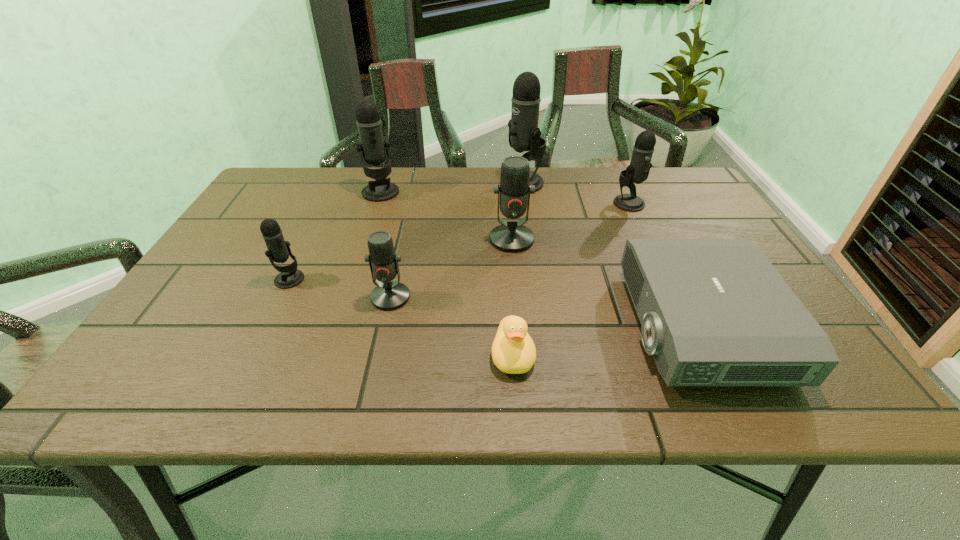
The image size is (960, 540). I want to click on the tallest object, so click(524, 135).

The image size is (960, 540). What are the coordinates of `the third black microphone from left to right` in the screenshot? It's located at tap(524, 135).

Where is `the third smallest black microphone`? The image size is (960, 540). the third smallest black microphone is located at coordinates (373, 146).

Locate an element on the screen. The image size is (960, 540). the fifth microphone from right to left is located at coordinates (373, 146).

What are the coordinates of `the bigger red microphone` in the screenshot? It's located at (513, 237).

Find the location of a particular element. The image size is (960, 540). the right red microphone is located at coordinates (513, 237).

You are a GUI agent. You are given a task and a screenshot of the screen. Output one action in this format:
    pyautogui.click(x=<x>, y=<y>)
    Task: Click on the rightmost microphone
    
    Given the screenshot: What is the action you would take?
    pyautogui.click(x=638, y=170)

Locate an element on the screen. the third biggest black microphone is located at coordinates (638, 170).

Find the location of a particular element. This screenshot has height=540, width=960. the nearest black microphone is located at coordinates (278, 251).

You are a GUI agent. You are given a task and a screenshot of the screen. Output one action in this format:
    pyautogui.click(x=<x>, y=<y>)
    Task: Click on the leftmost black microphone
    This screenshot has width=960, height=540.
    Given the screenshot: What is the action you would take?
    pyautogui.click(x=278, y=251)